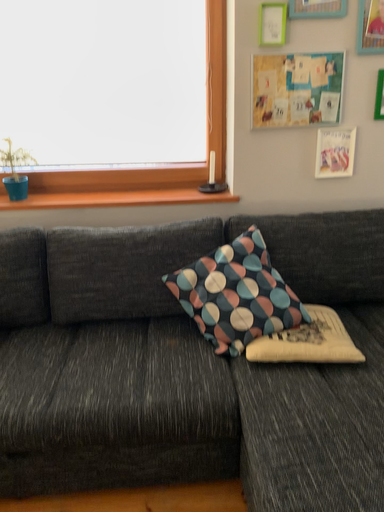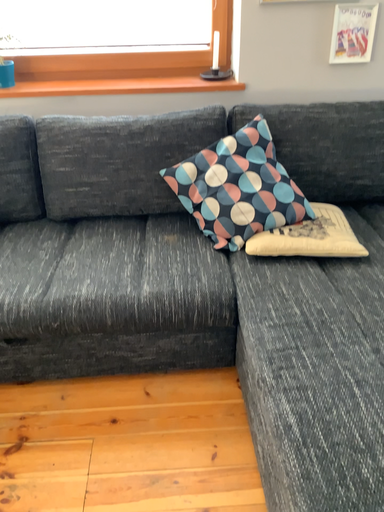
Question: How did the camera likely rotate when shooting the video?

Choices:
 (A) rotated upward
 (B) rotated downward

Answer: (B)